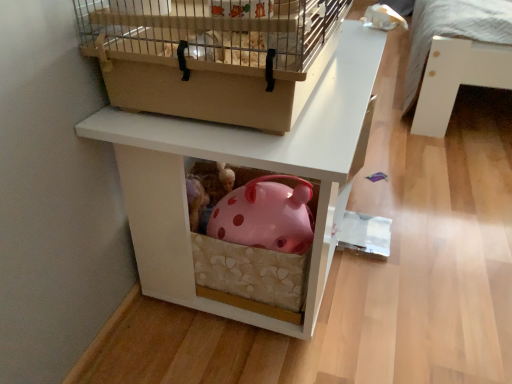
Where is `free spot to the right of pink polka dot piggy bank at center`? free spot to the right of pink polka dot piggy bank at center is located at coordinates (436, 213).